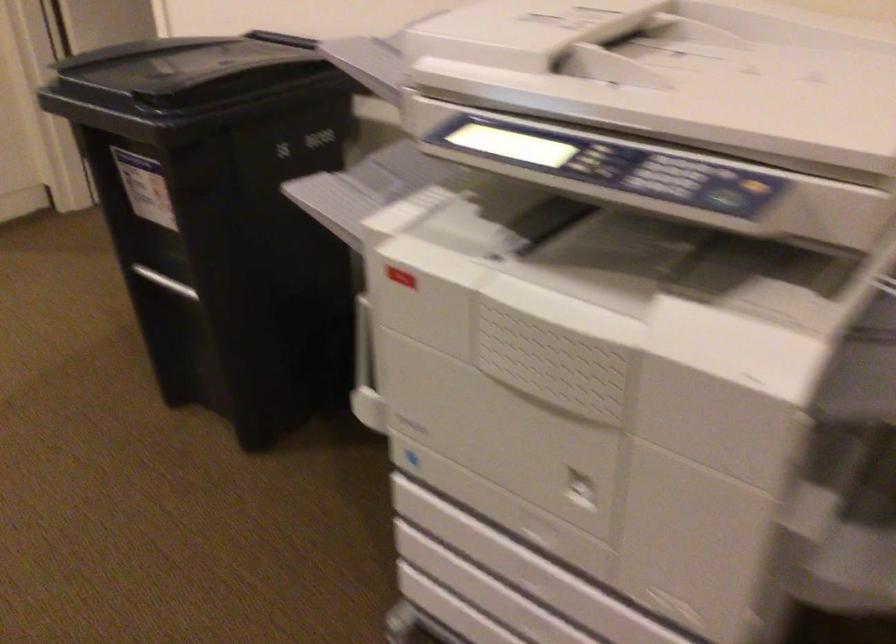
Describe the element at coordinates (188, 69) in the screenshot. This screenshot has width=896, height=644. I see `a black trash bin lid` at that location.